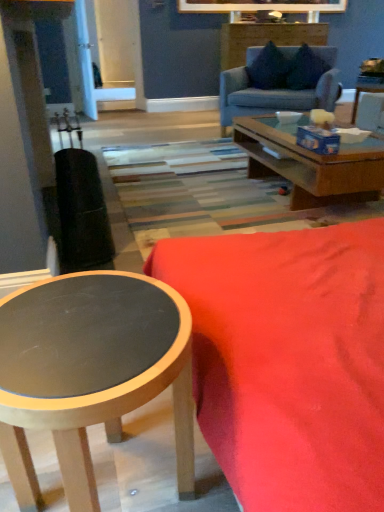
Question: In the image, is velvet red couch at lower right, marked as the first studio couch in a front-to-back arrangement, on the left side or the right side of suede-like dark blue pillow at upper center, marked as the 2th pillow in a left-to-right arrangement?

Choices:
 (A) right
 (B) left

Answer: (B)

Question: Is velvet red couch at lower right, the second studio couch in the back-to-front sequence, inside or outside of suede-like dark blue pillow at upper center, marked as the 2th pillow in a left-to-right arrangement?

Choices:
 (A) inside
 (B) outside

Answer: (B)

Question: Which of these objects is positioned closest to the velvet red couch at lower right, the second studio couch in the back-to-front sequence?

Choices:
 (A) matte black coffee table at lower left
 (B) light blue fabric couch at upper center, arranged as the first studio couch when viewed from the back
 (C) wooden side table at upper right
 (D) velvet dark blue pillow at upper center, arranged as the second pillow when viewed from the right
 (E) suede-like dark blue pillow at upper center, which is the 1th pillow in right-to-left order

Answer: (A)

Question: Estimate the real-world distances between objects in this image. Which object is farther from the velvet dark blue pillow at upper center, the first pillow in the left-to-right sequence?

Choices:
 (A) light blue fabric couch at upper center, which is the 2th studio couch from front to back
 (B) wooden side table at upper right
 (C) suede-like dark blue pillow at upper center, marked as the 2th pillow in a left-to-right arrangement
 (D) velvet red couch at lower right, which ranks as the second studio couch in top-to-bottom order
 (E) matte black coffee table at lower left

Answer: (E)